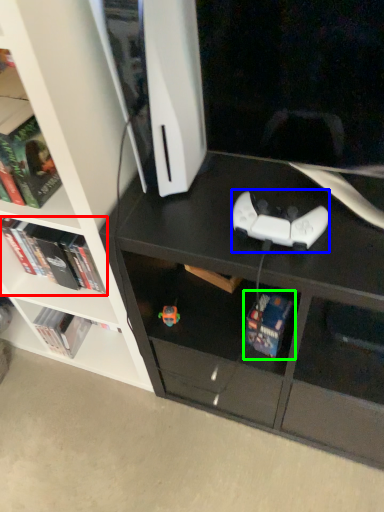
Question: Based on their relative distances, which object is nearer to book (highlighted by a red box)? Choose from game controller (highlighted by a blue box) and book (highlighted by a green box).

Choices:
 (A) game controller
 (B) book

Answer: (B)